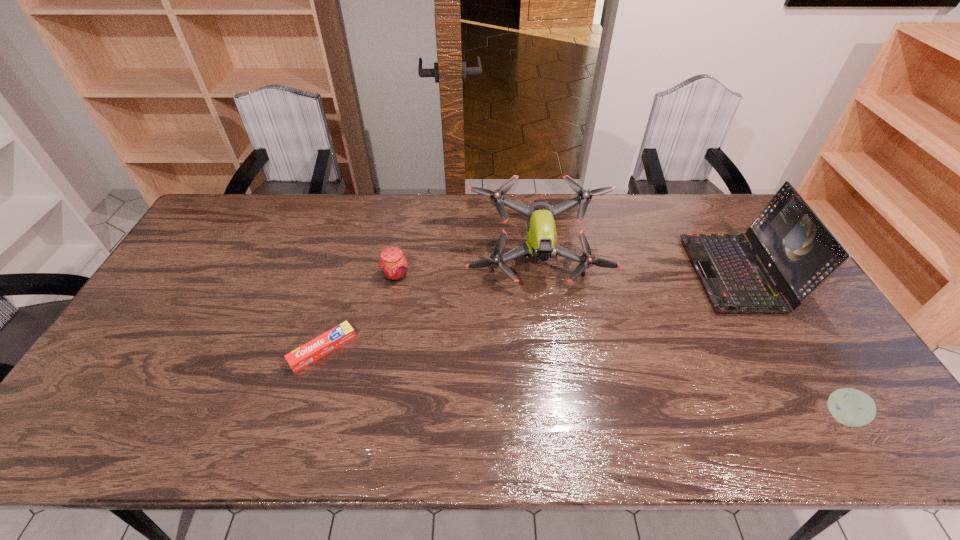
Image resolution: width=960 pixels, height=540 pixels. I want to click on drone, so click(541, 234).

The image size is (960, 540). In order to click on laptop computer in this screenshot , I will do `click(798, 250)`.

You are a GUI agent. You are given a task and a screenshot of the screen. Output one action in this format:
    pyautogui.click(x=<x>, y=<y>)
    Task: Click on the fourth object from right to left
    
    Given the screenshot: What is the action you would take?
    (x=393, y=263)

Locate an element on the screen. apple is located at coordinates pos(851,407).

Identify the location of the leftmost object. The image size is (960, 540). (308, 353).

Where is `the second nearest object`? the second nearest object is located at coordinates (308, 353).

Locate an element on the screen. This screenshot has height=540, width=960. free space located 0.060m on the front-facing side of the drone is located at coordinates (543, 308).

Where is `vacant area situated on the screen of the laptop computer`? vacant area situated on the screen of the laptop computer is located at coordinates (650, 273).

You are a GUI agent. You are given a task and a screenshot of the screen. Output one action in this format:
    pyautogui.click(x=<x>, y=<y>)
    Task: Click on the free space located 0.060m on the screen of the laptop computer
    
    Given the screenshot: What is the action you would take?
    pyautogui.click(x=676, y=273)

In order to click on vacant space located on the screen of the laptop computer in this screenshot , I will do `click(660, 273)`.